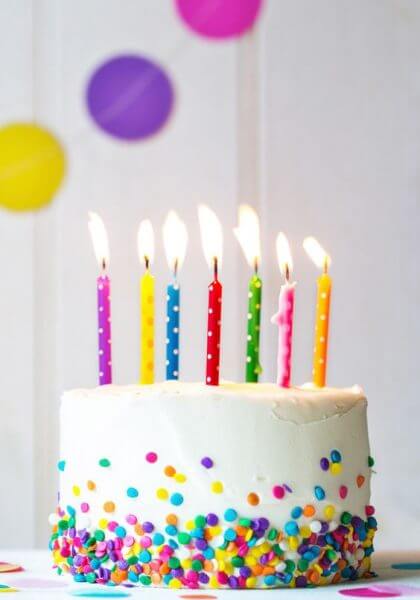
Locate an element on the screen. candle is located at coordinates (107, 318), (150, 312), (175, 318), (220, 329), (255, 318), (285, 316), (325, 334).